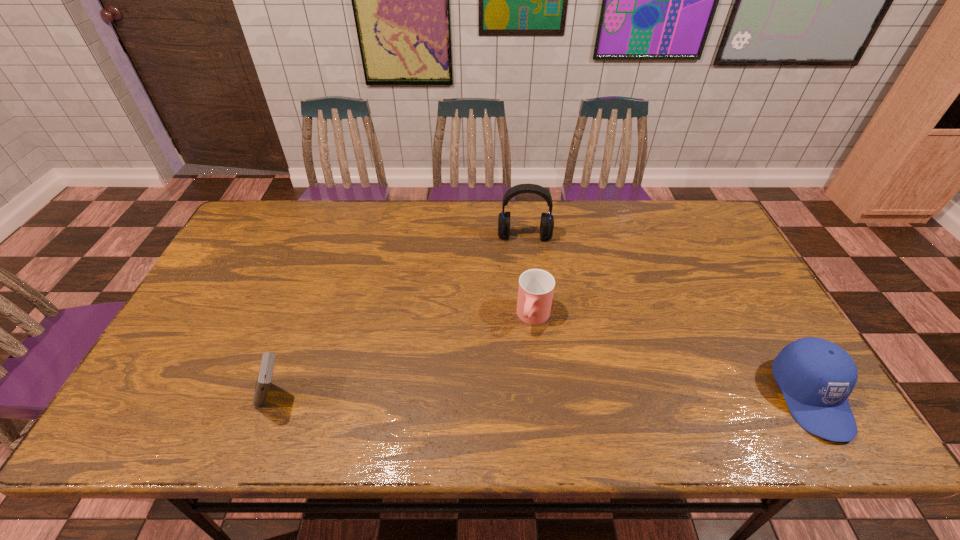
Image resolution: width=960 pixels, height=540 pixels. What are the coordinates of `calculator` in the screenshot? It's located at (264, 378).

At what (x,y) coordinates should I click in order to perform the action: click on cap. Please return your answer as a coordinate pair (x, y). Looking at the image, I should click on (816, 376).

Identify the location of headset. (547, 220).

Identify the location of the farthest object. This screenshot has height=540, width=960. (547, 220).

This screenshot has height=540, width=960. Identify the location of cup. (536, 287).

Find the location of a particular element. The image size is (960, 540). vacant space located on the front-facing side of the leftmost object is located at coordinates (156, 397).

At what (x,y) coordinates should I click in order to perform the action: click on vacant region located 0.270m on the front-facing side of the leftmost object. Please return your answer as a coordinate pair (x, y). The image size is (960, 540). Looking at the image, I should click on (139, 397).

In order to click on free space located 0.380m on the headband of the tallest object in this screenshot , I will do `click(526, 340)`.

The width and height of the screenshot is (960, 540). What are the coordinates of `vacant region located 0.170m on the headband of the tallest object` in the screenshot? It's located at pos(525,282).

Locate an element on the screen. vacant space located on the headband of the tallest object is located at coordinates (524, 261).